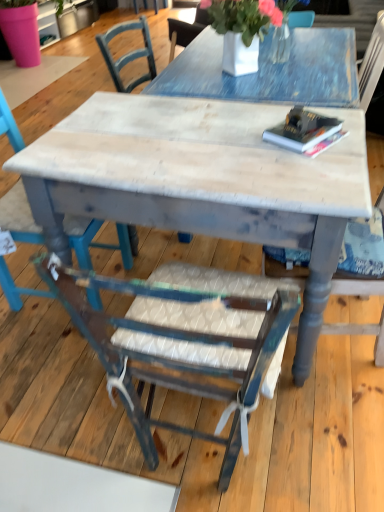
Locate an element on the screen. This screenshot has width=384, height=512. empty space that is ontop of hardcover book at upper right (from a real-world perspective) is located at coordinates (312, 129).